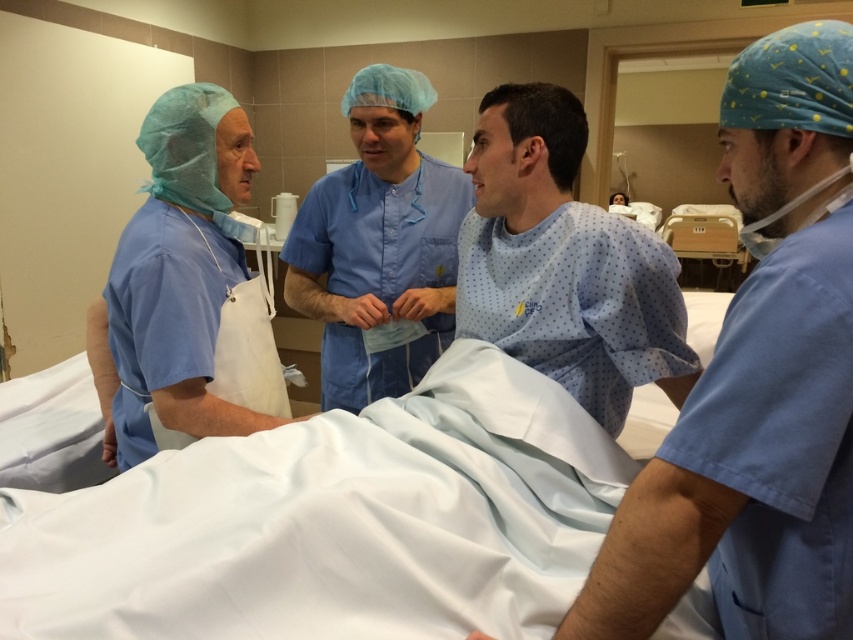
Question: Which is farther from the blue scrubs at left?

Choices:
 (A) light blue fabric at center
 (B) blue scrubs at center

Answer: (B)

Question: Is blue scrubs at center below blue smooth scrubs at center?

Choices:
 (A) no
 (B) yes

Answer: (B)

Question: Which is farther from the blue scrubs at center?

Choices:
 (A) light blue fabric at center
 (B) blue smooth scrubs at center
 (C) blue scrubs at left

Answer: (B)

Question: Which point appears farthest from the camera in this image?

Choices:
 (A) (245, 266)
 (B) (641, 284)

Answer: (A)

Question: Does blue scrubs at left lie behind blue smooth scrubs at center?

Choices:
 (A) no
 (B) yes

Answer: (A)

Question: From the image, what is the correct spatial relationship of blue scrubs at center in relation to light blue fabric at center?

Choices:
 (A) below
 (B) above

Answer: (A)